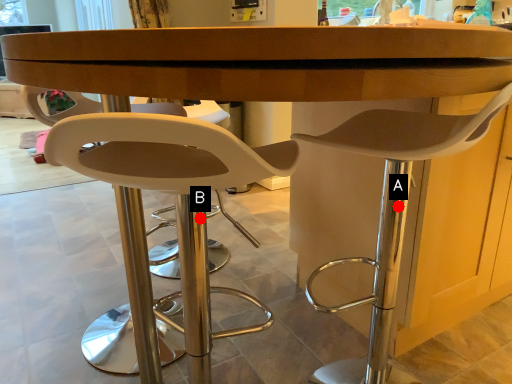
Question: Two points are circled on the image, labeled by A and B beside each circle. Which of the following is the closest to the observer?

Choices:
 (A) A is closer
 (B) B is closer

Answer: (B)